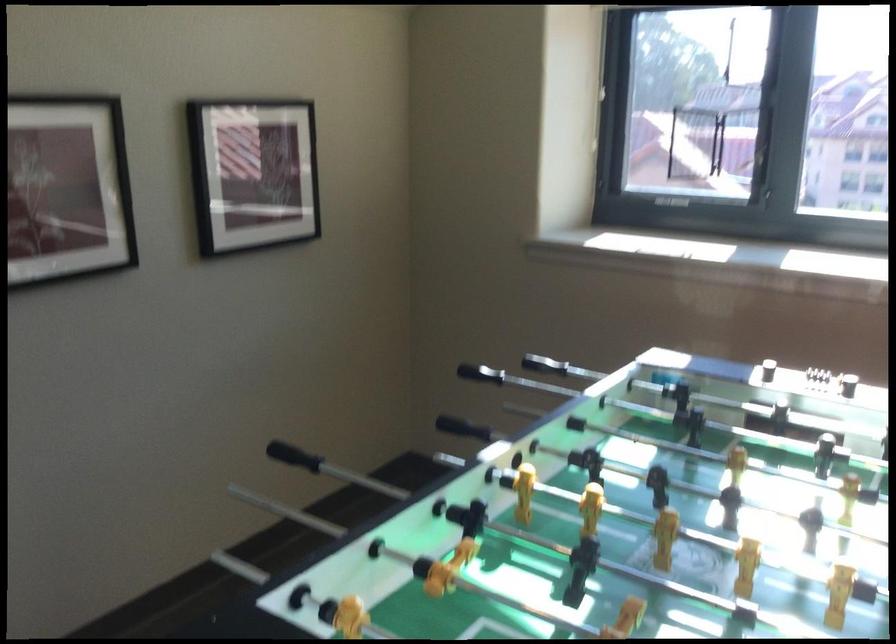
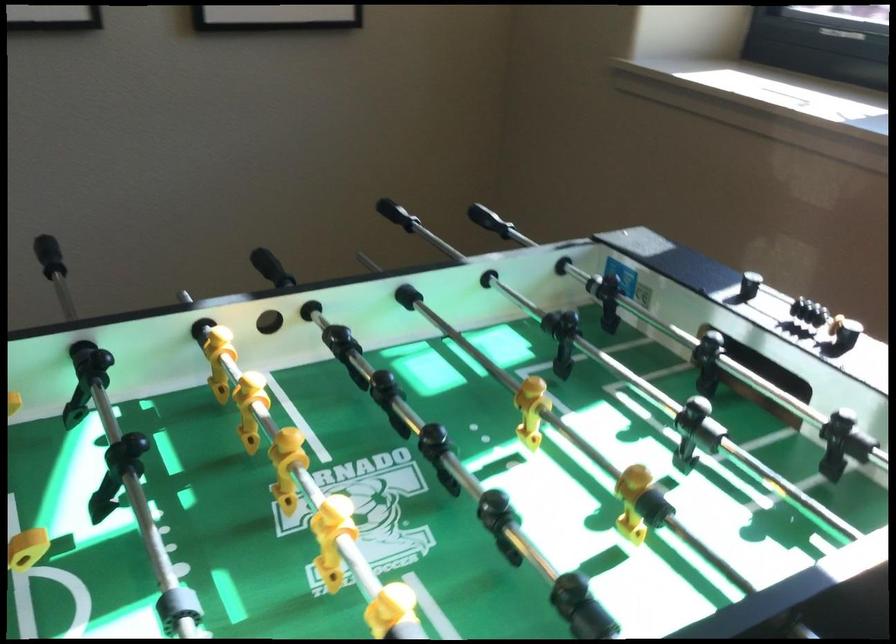
In a continuous first-person perspective shot, in which direction is the camera moving?

The cameraman moved toward right, forward.